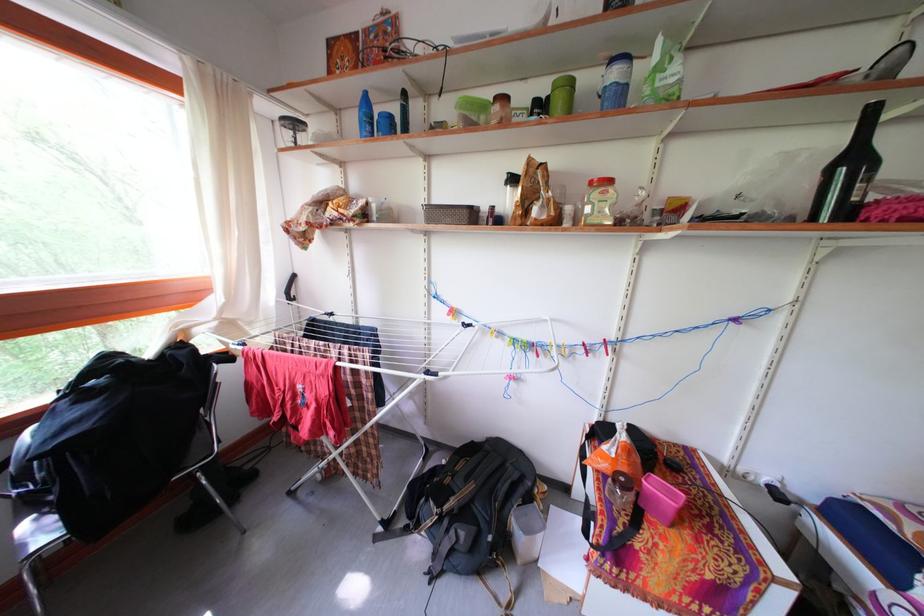
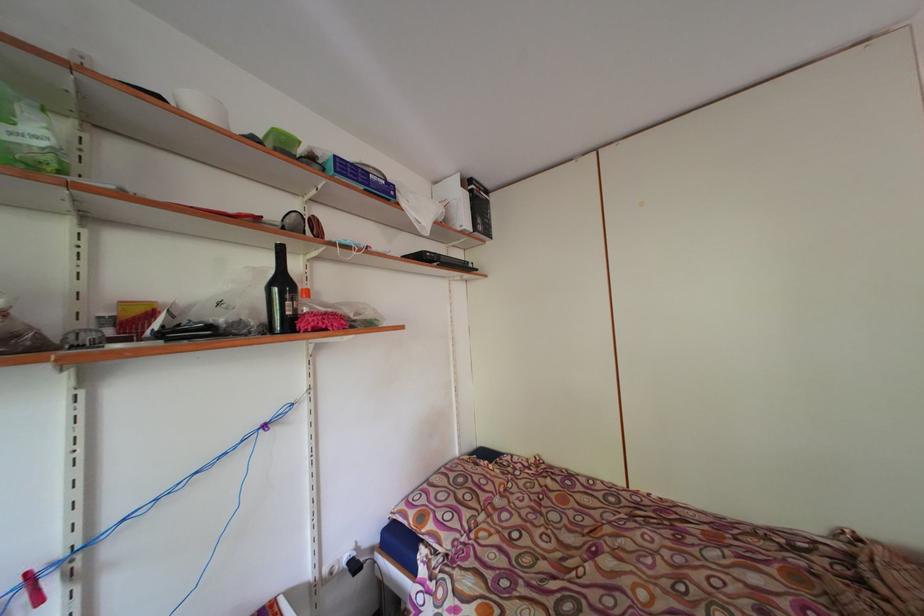
In the second image, find the point that corresponds to (x=861, y=166) in the first image.

(290, 289)